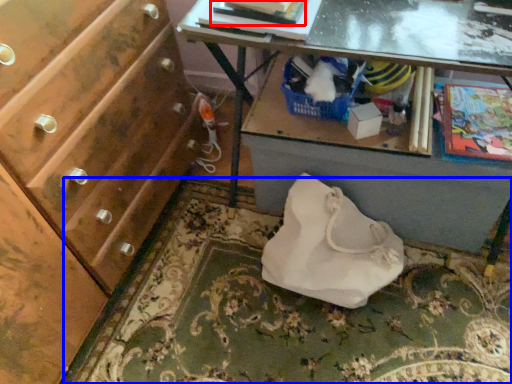
Question: Which object appears farthest to the camera in this image, magazine (highlighted by a red box) or mat (highlighted by a blue box)?

Choices:
 (A) magazine
 (B) mat

Answer: (B)